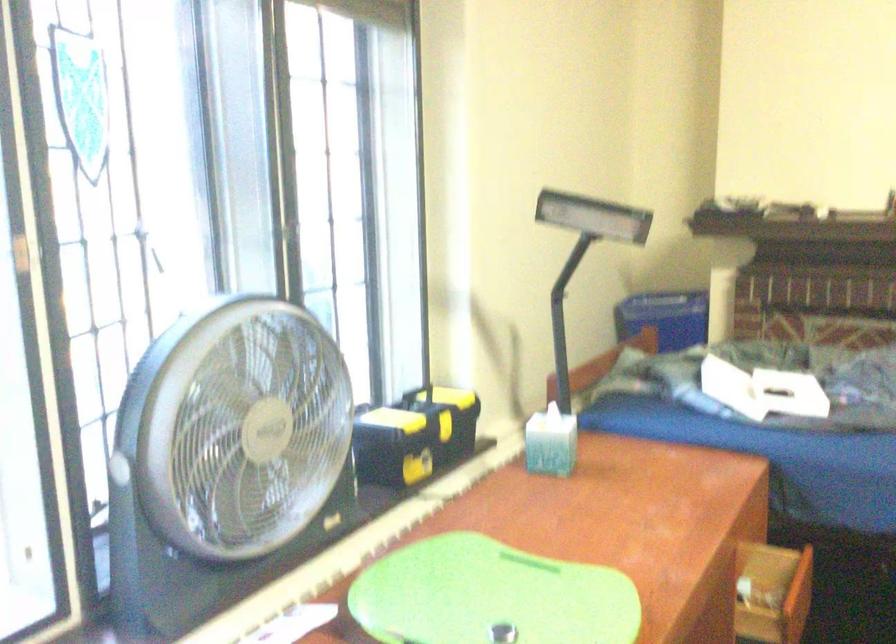
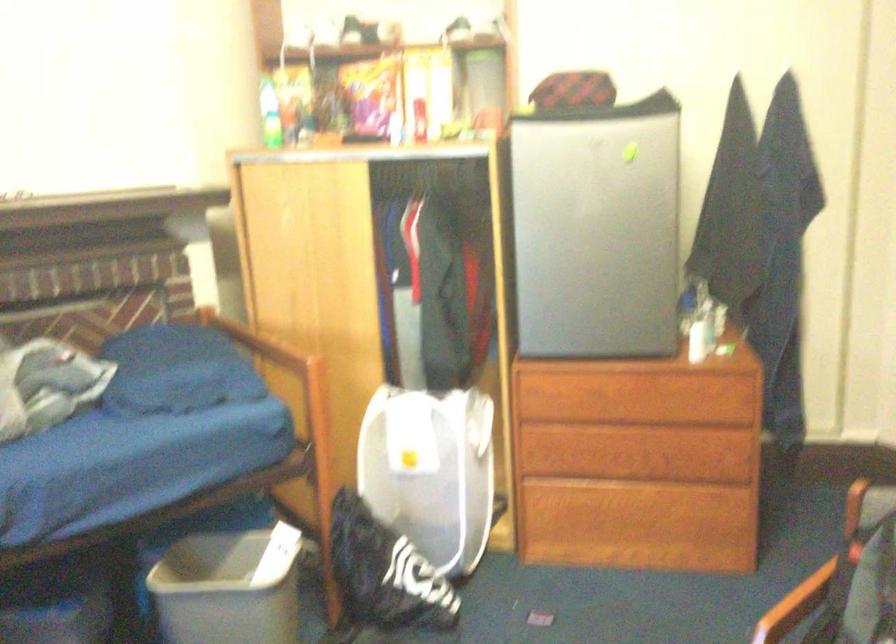
Question: The images are taken continuously from a first-person perspective. In which direction is your viewpoint rotating?

Choices:
 (A) Left
 (B) Right
 (C) Up
 (D) Down

Answer: (B)